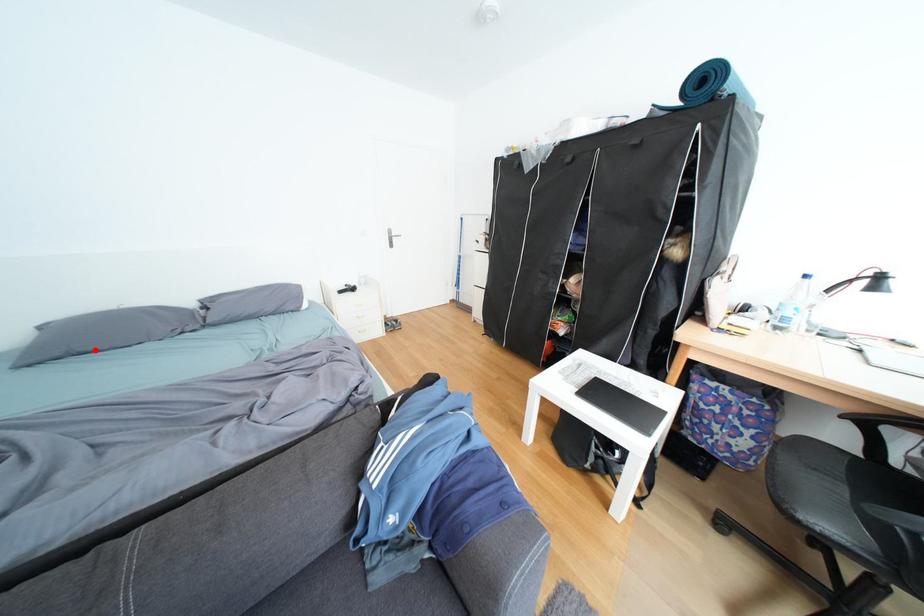
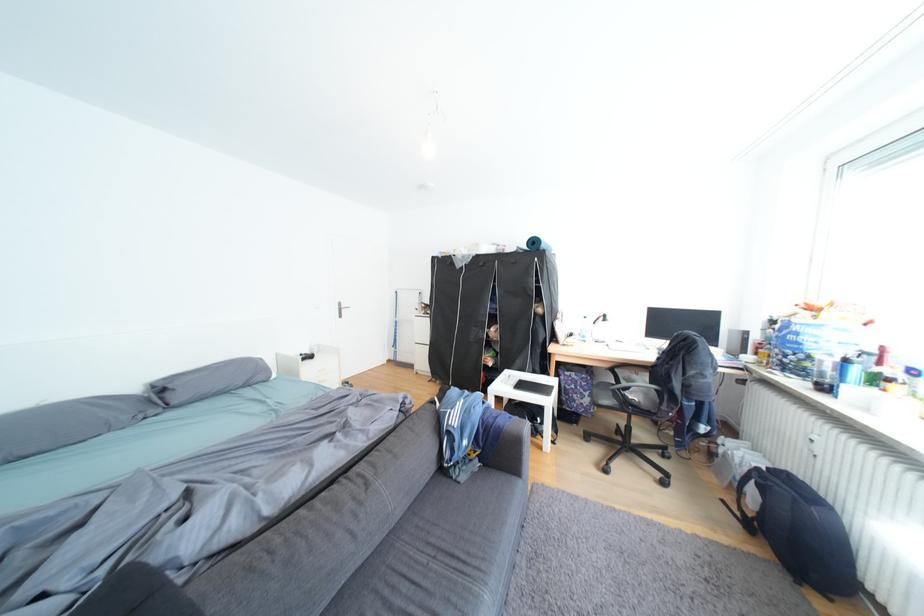
Question: I am providing you with two images of the same scene from different viewpoints. Image1 has a red point marked. In image2, the corresponding 3D location appears at what relative position? Reply with the corresponding letter.

Choices:
 (A) Closer
 (B) Farther

Answer: (A)